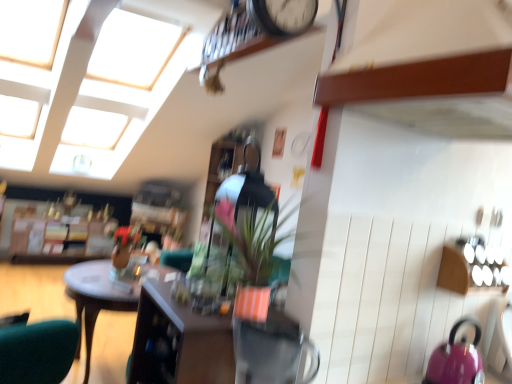
Question: Is matte orange pot at center oriented away from pink glossy kettle at lower right?

Choices:
 (A) yes
 (B) no

Answer: (B)

Question: Is matte orange pot at center smaller than pink glossy kettle at lower right?

Choices:
 (A) yes
 (B) no

Answer: (B)

Question: From a real-world perspective, is matte orange pot at center below pink glossy kettle at lower right?

Choices:
 (A) yes
 (B) no

Answer: (B)

Question: From the image's perspective, is matte orange pot at center below pink glossy kettle at lower right?

Choices:
 (A) yes
 (B) no

Answer: (B)

Question: Is there a large distance between matte orange pot at center and pink glossy kettle at lower right?

Choices:
 (A) yes
 (B) no

Answer: (B)

Question: Is pink glossy kettle at lower right a part of matte orange pot at center?

Choices:
 (A) no
 (B) yes

Answer: (A)

Question: Is wooden desk at center a part of matte orange pot at center?

Choices:
 (A) yes
 (B) no

Answer: (B)

Question: Considering the relative sizes of matte orange pot at center and wooden desk at center in the image provided, is matte orange pot at center smaller than wooden desk at center?

Choices:
 (A) no
 (B) yes

Answer: (B)

Question: Is matte orange pot at center behind wooden desk at center?

Choices:
 (A) yes
 (B) no

Answer: (B)

Question: Is matte orange pot at center to the left of wooden desk at center from the viewer's perspective?

Choices:
 (A) no
 (B) yes

Answer: (A)

Question: Would you say matte orange pot at center is outside wooden desk at center?

Choices:
 (A) no
 (B) yes

Answer: (B)

Question: Are matte orange pot at center and wooden desk at center far apart?

Choices:
 (A) yes
 (B) no

Answer: (A)

Question: Would you say matte orange pot at center is part of pink glossy kettle at lower right's contents?

Choices:
 (A) yes
 (B) no

Answer: (B)